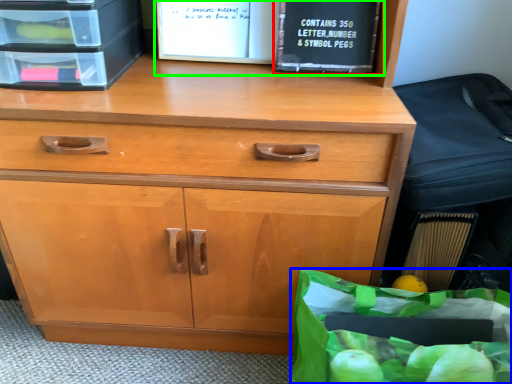
Question: Which is nearer to the paperback book (highlighted by a red box)? grocery bag (highlighted by a blue box) or book (highlighted by a green box).

Choices:
 (A) grocery bag
 (B) book

Answer: (B)